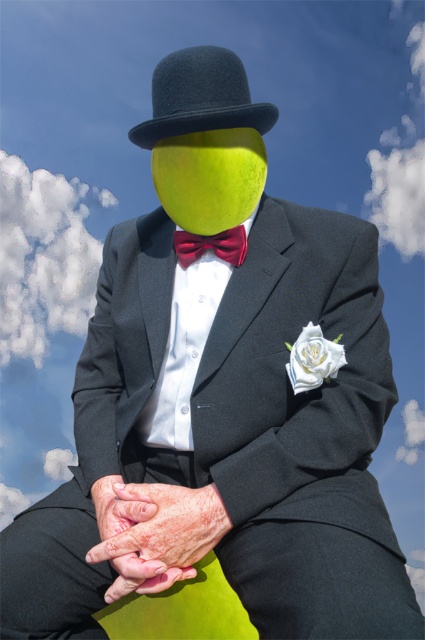
At what (x,y) coordinates should I click in order to perform the action: click on black felt fedora at center. Please return your answer as a coordinate pair (x, y). This screenshot has width=425, height=640. Looking at the image, I should click on (201, 97).

Does point (255, 106) come behind point (178, 257)?

No, it is in front of (178, 257).

The width and height of the screenshot is (425, 640). In order to click on black felt fedora at center in this screenshot , I will do `click(201, 97)`.